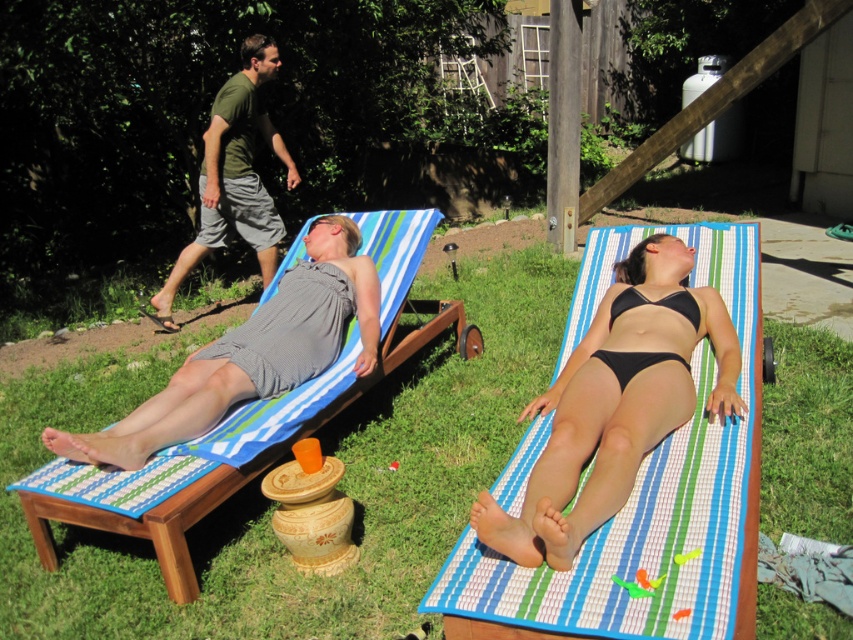
Question: Is black bikini at center bigger than gray striped dress at left?

Choices:
 (A) no
 (B) yes

Answer: (A)

Question: Which point is farther from the camera taking this photo?

Choices:
 (A) (213, 244)
 (B) (163, 557)
 (C) (250, 532)

Answer: (A)

Question: Does black bikini at center have a greater width compared to green fabric shorts at upper left?

Choices:
 (A) no
 (B) yes

Answer: (A)

Question: Is the position of gray striped dress at left less distant than that of green fabric shorts at upper left?

Choices:
 (A) yes
 (B) no

Answer: (A)

Question: Which object is the closest to the black bikini at center?

Choices:
 (A) green grass at lower center
 (B) wooden daybed at left
 (C) gray striped dress at left
 (D) green fabric shorts at upper left

Answer: (A)

Question: Considering the real-world distances, which object is farthest from the green fabric shorts at upper left?

Choices:
 (A) gray striped dress at left
 (B) black bikini at center
 (C) wooden daybed at left
 (D) green grass at lower center

Answer: (B)